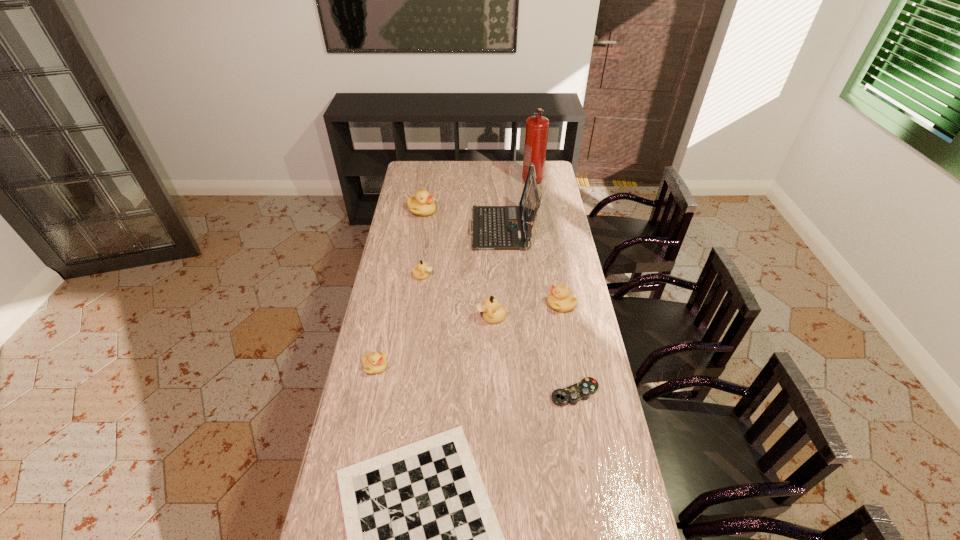
Identify the location of the farthest object. (536, 134).

You are a GUI agent. You are given a task and a screenshot of the screen. Output one action in this format:
    pyautogui.click(x=<x>, y=<y>)
    Task: Click on the tallest object
    This screenshot has height=540, width=960.
    Given the screenshot: What is the action you would take?
    pyautogui.click(x=536, y=134)

Identify the location of laptop computer. The height and width of the screenshot is (540, 960). (494, 227).

You are a GUI agent. You are given a task and a screenshot of the screen. Output one action in this format:
    pyautogui.click(x=<x>, y=<y>)
    Task: Click on the farthest duckling
    The image size is (960, 540).
    Given the screenshot: What is the action you would take?
    pyautogui.click(x=422, y=204)

Find the location of a particular element. the farthest yellow duckling is located at coordinates (422, 204).

Where is `the bigger tan duckling`? The height and width of the screenshot is (540, 960). the bigger tan duckling is located at coordinates click(492, 313).

Locate an element on the screen. The height and width of the screenshot is (540, 960). the right tan duckling is located at coordinates (492, 313).

Identify the location of the rightmost duckling. (560, 299).

Where is `the second smallest yellow duckling`? This screenshot has height=540, width=960. the second smallest yellow duckling is located at coordinates (560, 299).

Where is `the farther tan duckling`? the farther tan duckling is located at coordinates (421, 272).